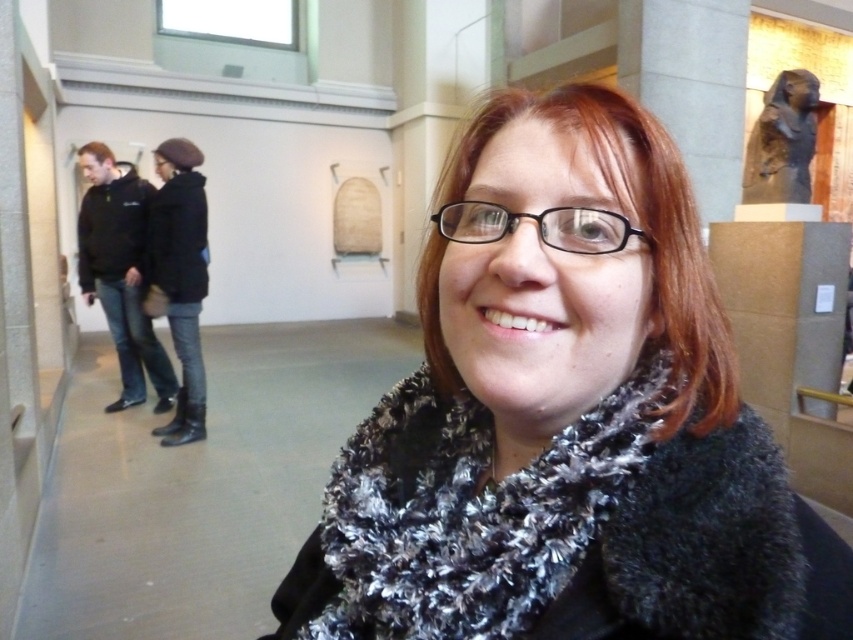
Question: Is fuzzy black-and-white scarf at center below black leather boots at lower left?

Choices:
 (A) yes
 (B) no

Answer: (A)

Question: Which point appears farthest from the camera in this image?

Choices:
 (A) 492,193
 (B) 389,630

Answer: (B)

Question: Is black fuzzy scarf at center closer to the viewer compared to black leather boots at lower left?

Choices:
 (A) no
 (B) yes

Answer: (B)

Question: Among these objects, which one is nearest to the camera?

Choices:
 (A) black hoodie at left
 (B) fuzzy black-and-white scarf at center
 (C) black leather boots at lower left

Answer: (B)

Question: Is the position of fuzzy black-and-white scarf at center less distant than that of black hoodie at left?

Choices:
 (A) yes
 (B) no

Answer: (A)

Question: Considering the real-world distances, which object is closest to the fuzzy black-and-white scarf at center?

Choices:
 (A) black leather boots at lower left
 (B) black fuzzy scarf at center
 (C) black hoodie at left

Answer: (B)